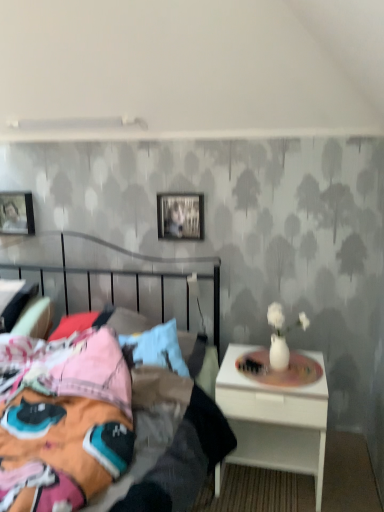
Question: Is matte black picture frame at upper left, marked as the 2th picture frame in a right-to-left arrangement, wider than metallic silver picture frame at upper center, placed as the first picture frame when sorted from right to left?

Choices:
 (A) no
 (B) yes

Answer: (B)

Question: Considering the relative sizes of matte black picture frame at upper left, marked as the 2th picture frame in a right-to-left arrangement, and metallic silver picture frame at upper center, the 2th picture frame viewed from the left, in the image provided, is matte black picture frame at upper left, marked as the 2th picture frame in a right-to-left arrangement, taller than metallic silver picture frame at upper center, the 2th picture frame viewed from the left,?

Choices:
 (A) yes
 (B) no

Answer: (B)

Question: Does matte black picture frame at upper left, arranged as the 2th picture frame when viewed from the front, lie behind metallic silver picture frame at upper center, arranged as the first picture frame when viewed from the front?

Choices:
 (A) no
 (B) yes

Answer: (B)

Question: Can you confirm if matte black picture frame at upper left, the 1th picture frame viewed from the left, is shorter than metallic silver picture frame at upper center, the 2th picture frame viewed from the left?

Choices:
 (A) no
 (B) yes

Answer: (B)

Question: Is the surface of matte black picture frame at upper left, which appears as the 1th picture frame when viewed from the back, in direct contact with metallic silver picture frame at upper center, the 2th picture frame viewed from the left?

Choices:
 (A) no
 (B) yes

Answer: (A)

Question: Is matte black picture frame at upper left, the 1th picture frame viewed from the left, looking in the opposite direction of metallic silver picture frame at upper center, placed as the first picture frame when sorted from right to left?

Choices:
 (A) no
 (B) yes

Answer: (A)

Question: Is metallic silver picture frame at upper center, the 2th picture frame viewed from the left, positioned with its back to matte black picture frame at upper left, marked as the 2th picture frame in a right-to-left arrangement?

Choices:
 (A) yes
 (B) no

Answer: (B)

Question: Does metallic silver picture frame at upper center, the 2th picture frame in the back-to-front sequence, turn towards matte black picture frame at upper left, the 1th picture frame viewed from the left?

Choices:
 (A) yes
 (B) no

Answer: (B)

Question: Is metallic silver picture frame at upper center, arranged as the first picture frame when viewed from the front, far away from matte black picture frame at upper left, the 1th picture frame viewed from the left?

Choices:
 (A) no
 (B) yes

Answer: (A)

Question: Considering the relative positions of metallic silver picture frame at upper center, the 2th picture frame in the back-to-front sequence, and matte black picture frame at upper left, arranged as the 2th picture frame when viewed from the front, in the image provided, is metallic silver picture frame at upper center, the 2th picture frame in the back-to-front sequence, behind matte black picture frame at upper left, arranged as the 2th picture frame when viewed from the front,?

Choices:
 (A) no
 (B) yes

Answer: (A)

Question: From a real-world perspective, is metallic silver picture frame at upper center, arranged as the first picture frame when viewed from the front, over matte black picture frame at upper left, which appears as the 1th picture frame when viewed from the back?

Choices:
 (A) no
 (B) yes

Answer: (B)

Question: Is metallic silver picture frame at upper center, the 2th picture frame in the back-to-front sequence, thinner than matte black picture frame at upper left, marked as the 2th picture frame in a right-to-left arrangement?

Choices:
 (A) no
 (B) yes

Answer: (B)

Question: Is metallic silver picture frame at upper center, arranged as the first picture frame when viewed from the front, behind white glossy nightstand at right?

Choices:
 (A) yes
 (B) no

Answer: (A)